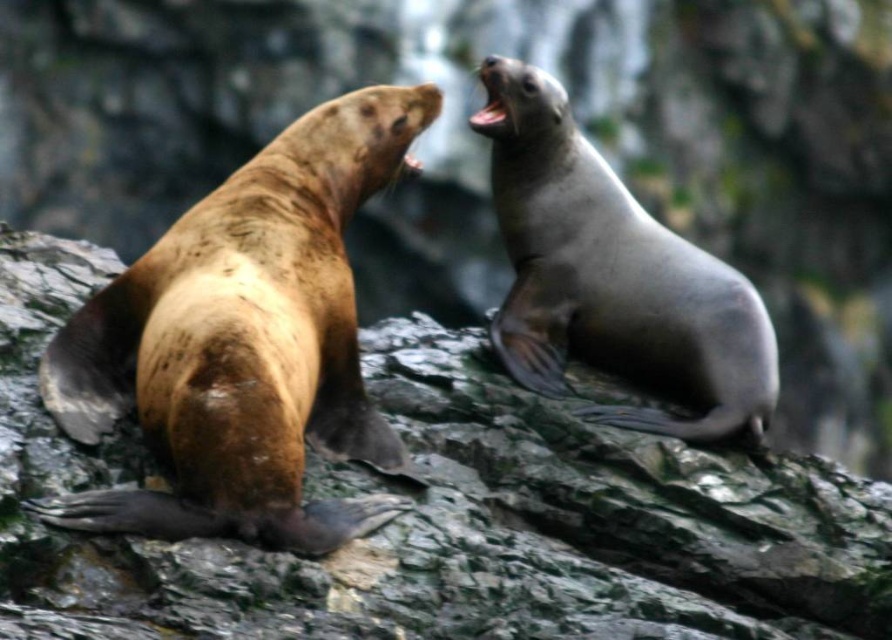
You are a photographer trying to capture a clear photo of the smooth gray seal at upper right. However, the green rock at center is blocking your view. Can you move the rock to the side to get a clear shot? Explain why or why not based on their positions.

The green rock at center is in front of the smooth gray seal at upper right, so moving the rock to the side would allow you to get a clear shot of the smooth gray seal at upper right as it is currently blocking the view.

You are a photographer trying to capture a photo of the smooth gray seal at upper right. You notice the green rock at center is blocking your view. Can you move the rock to the right to get a clear shot? Explain why or why not based on their positions.

The green rock at center is positioned on the left side of the smooth gray seal at upper right. Since the rock is already to the left of the seal, moving it further to the right would place it closer to the seal, potentially blocking the view more. Therefore, moving the rock to the right is not advisable as it would worsen the obstruction.

You are a photographer trying to capture both the green rock at center and the brown fur seal at left in a single frame. Which object is wider so that you can adjust your camera angle accordingly?

The green rock at center is wider than the brown fur seal at left, so you should position your camera to ensure the green rock at center fits properly in the frame.